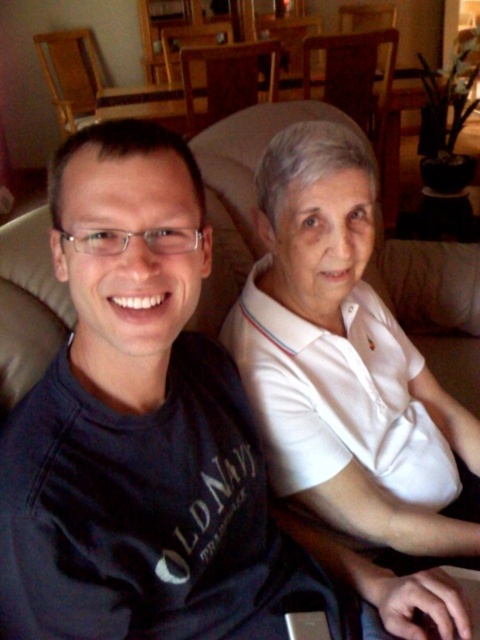
Question: Which point is farther to the camera?

Choices:
 (A) (109, 86)
 (B) (391, 440)

Answer: (A)

Question: Does white smooth shirt at center appear over wooden chair at upper center?

Choices:
 (A) yes
 (B) no

Answer: (B)

Question: Which point is farther from the camera taking this photo?

Choices:
 (A) (433, 445)
 (B) (145, 93)

Answer: (B)

Question: Can you confirm if white smooth shirt at center is bigger than wooden chair at upper center?

Choices:
 (A) yes
 (B) no

Answer: (B)

Question: Which of the following is the closest to the observer?

Choices:
 (A) white smooth shirt at center
 (B) wooden chair at upper center

Answer: (A)

Question: Is white smooth shirt at center to the left of wooden chair at upper center from the viewer's perspective?

Choices:
 (A) no
 (B) yes

Answer: (A)